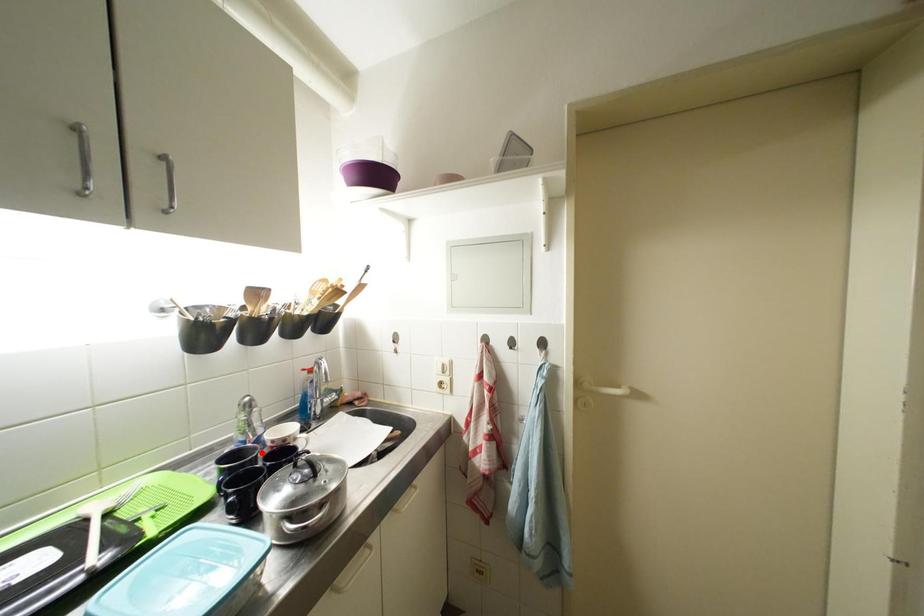
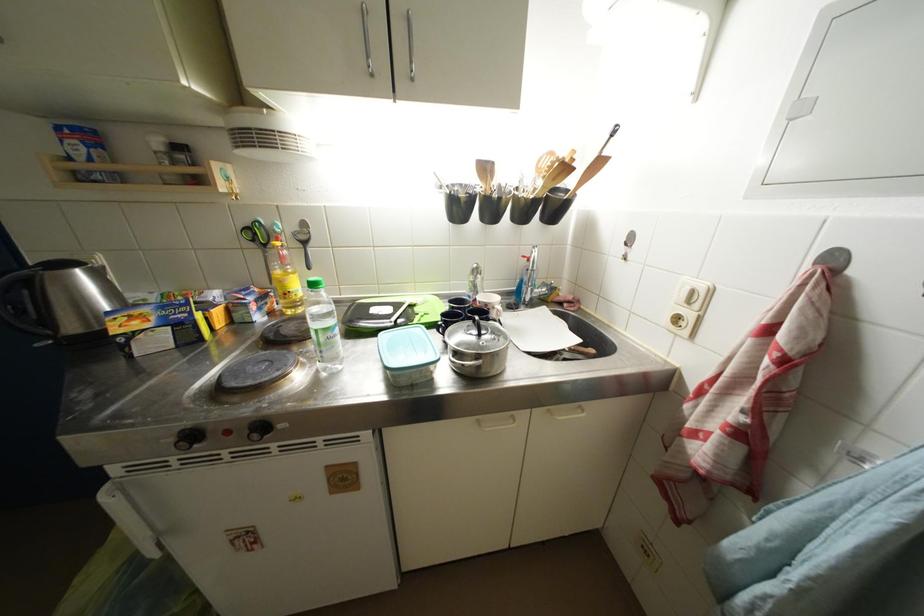
Locate, in the second image, the point that corresponds to the highlighted location in the first image.

(477, 307)